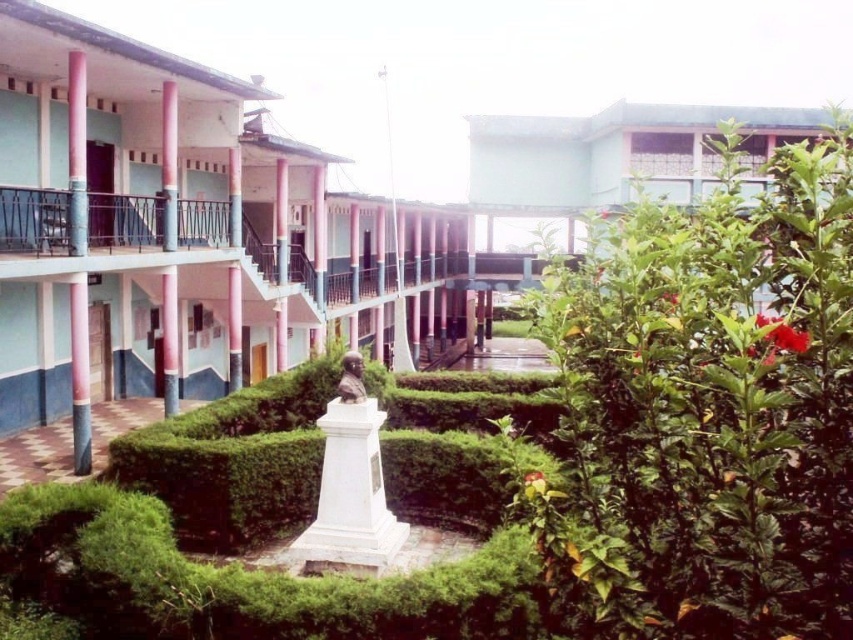
Between green leafy hedge at center and bright red petal at upper right, which one is positioned higher?

bright red petal at upper right is above.

Is green leafy hedge at center bigger than bright red petal at upper right?

Indeed, green leafy hedge at center has a larger size compared to bright red petal at upper right.

At what (x,y) coordinates should I click in order to perform the action: click on green leafy hedge at center. Please return your answer as a coordinate pair (x, y). Looking at the image, I should click on (235, 461).

Consider the image. Between green leafy bush at right and white glossy pillar at center, which one is positioned higher?

white glossy pillar at center is higher up.

Which is in front, point (663, 282) or point (167, 236)?

Point (663, 282)

Who is more distant from viewer, (788, 371) or (167, 284)?

The point (167, 284) is behind.

This screenshot has height=640, width=853. In order to click on green leafy bush at right in this screenshot , I will do `click(709, 410)`.

Between white glossy pillar at center and bright red petal at upper right, which one has less height?

With less height is bright red petal at upper right.

Between white glossy pillar at center and bright red petal at upper right, which one is positioned higher?

white glossy pillar at center is higher up.

Looking at this image, who is more distant from viewer, (167, 401) or (763, 316)?

Point (167, 401)

What are the coordinates of `white glossy pillar at center` in the screenshot? It's located at (169, 164).